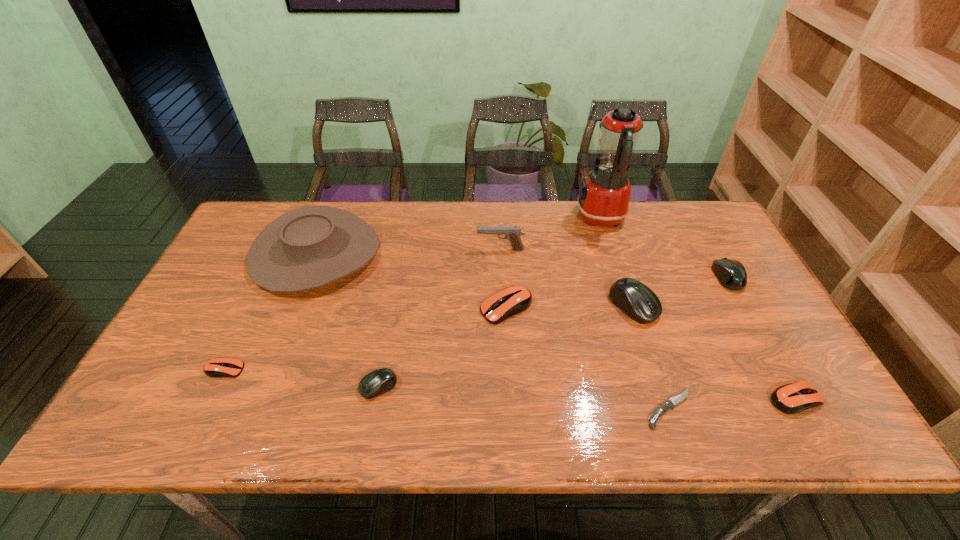
The height and width of the screenshot is (540, 960). Identify the location of free region at the left edge. (217, 343).

Locate an element on the screen. Image resolution: width=960 pixels, height=540 pixels. free space at the far right corner of the desktop is located at coordinates (670, 219).

The image size is (960, 540). In order to click on vacant space that is in between the biggest orange computer mouse and the third computer mouse from right to left in this screenshot , I will do `click(570, 307)`.

Locate an element on the screen. This screenshot has width=960, height=540. vacant area that lies between the second biggest black mouse and the pocketknife is located at coordinates (698, 343).

Locate an element on the screen. The image size is (960, 540). vacant area that lies between the rightmost black mouse and the pistol is located at coordinates (613, 264).

Where is `vacant point located between the food processor and the leftmost orange computer mouse`? The image size is (960, 540). vacant point located between the food processor and the leftmost orange computer mouse is located at coordinates (413, 294).

You are a GUI agent. You are given a task and a screenshot of the screen. Output one action in this format:
    pyautogui.click(x=<x>, y=<y>)
    Task: Click on the free space between the cowboy hat and the nearest orange computer mouse
    The image size is (960, 540).
    Given the screenshot: What is the action you would take?
    point(555,326)

Locate an element on the screen. This screenshot has height=540, width=960. free space between the nearest orange computer mouse and the farthest orange computer mouse is located at coordinates coord(651,353).

I want to click on blank region between the food processor and the cowboy hat, so (x=458, y=236).

The height and width of the screenshot is (540, 960). What are the coordinates of `free spot between the second computer mouse from left to right and the pocketknife` in the screenshot? It's located at 524,398.